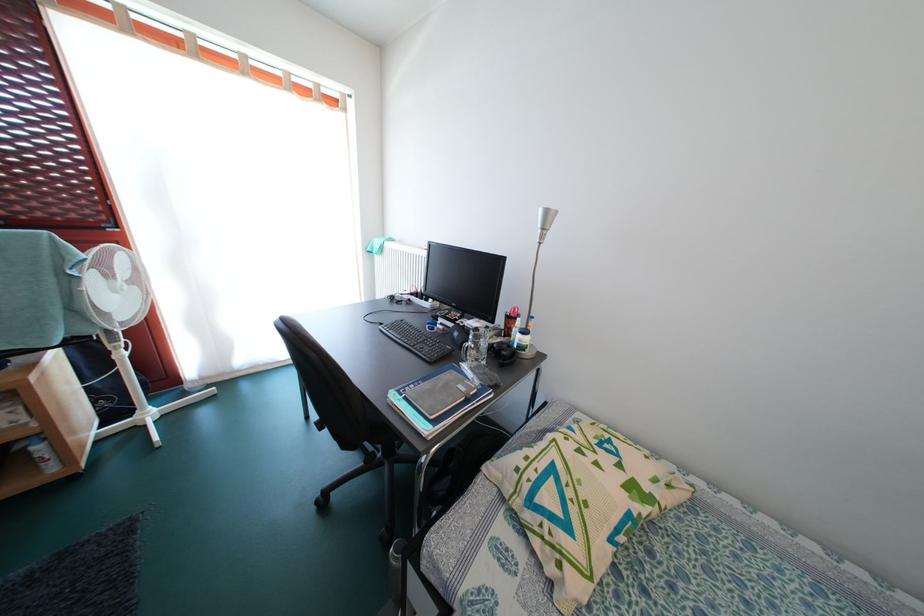
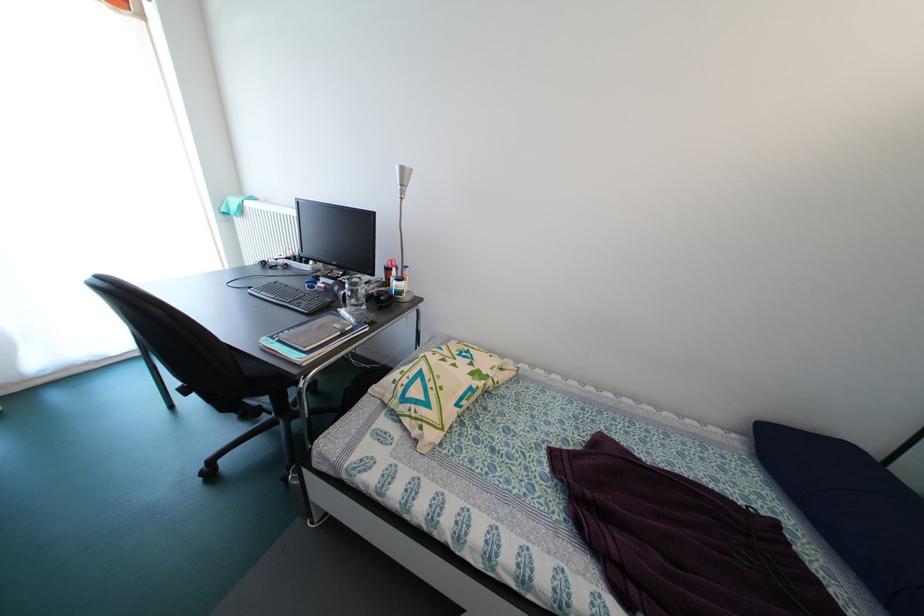
In the second image, find the point that corresponds to pixel 463 339 in the first image.

(344, 294)